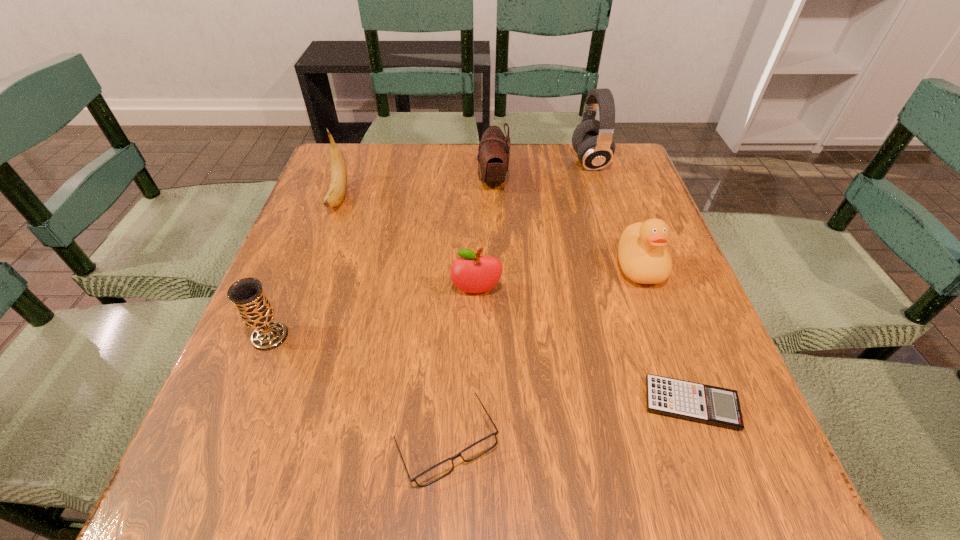
Locate an element on the screen. free space at the far edge of the desktop is located at coordinates (467, 166).

In the image, there is a desktop. Identify the location of vacant space at the left edge. The height and width of the screenshot is (540, 960). (332, 211).

Find the location of a particular element. free space at the right edge of the desktop is located at coordinates (670, 370).

In the image, there is a desktop. Identify the location of vacant region at the far left corner. The width and height of the screenshot is (960, 540). (324, 172).

Locate an element on the screen. This screenshot has height=540, width=960. vacant area at the far right corner is located at coordinates (635, 169).

You are a GUI agent. You are given a task and a screenshot of the screen. Output one action in this format:
    pyautogui.click(x=<x>, y=<y>)
    Task: Click on the free space at the near right corner of the desktop
    
    Given the screenshot: What is the action you would take?
    pyautogui.click(x=699, y=461)

The height and width of the screenshot is (540, 960). What are the coordinates of `free area in between the calculator and the duck` in the screenshot? It's located at (665, 335).

What are the coordinates of `vacant area that lies between the third nearest object and the second shortest object` in the screenshot? It's located at (358, 389).

What are the coordinates of `free space between the chalice and the seventh tallest object` in the screenshot? It's located at (358, 389).

The width and height of the screenshot is (960, 540). I want to click on vacant area that lies between the seventh tallest object and the tallest object, so click(x=518, y=302).